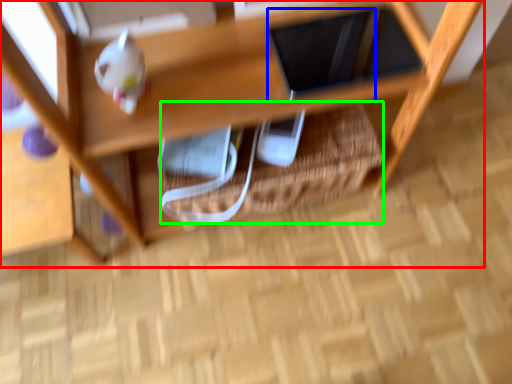
Question: Which object is positioned closest to shelf (highlighted by a red box)? Select from tablet computer (highlighted by a blue box) and basket (highlighted by a green box).

Choices:
 (A) tablet computer
 (B) basket

Answer: (B)